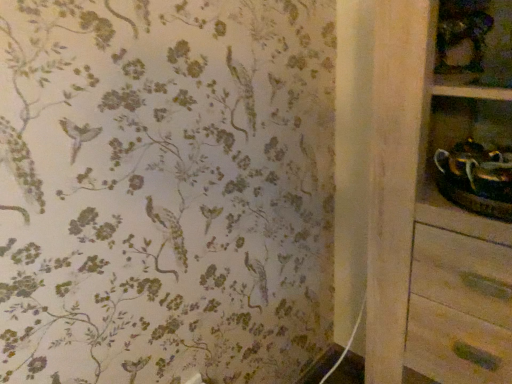
Locate an element on the screen. wooden shelf at upper right is located at coordinates (474, 43).

What do you see at coordinates (474, 43) in the screenshot?
I see `wooden shelf at upper right` at bounding box center [474, 43].

You are a GUI agent. You are given a task and a screenshot of the screen. Output one action in this format:
    pyautogui.click(x=<x>, y=<y>)
    Task: Click on the wooden shelf at upper right
    The width and height of the screenshot is (512, 384).
    Given the screenshot: What is the action you would take?
    pyautogui.click(x=474, y=43)